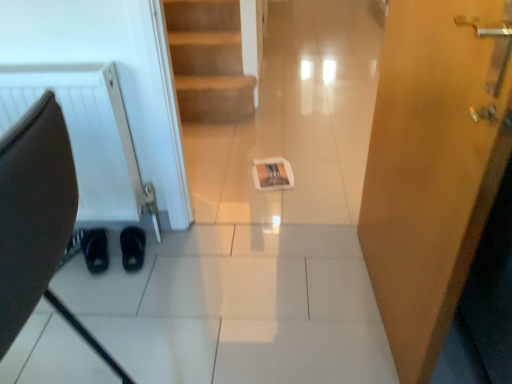
The width and height of the screenshot is (512, 384). Identify the location of vacant area located to the right-hand side of black suede shoes at lower left, the first footwear positioned from the right. (x=170, y=248).